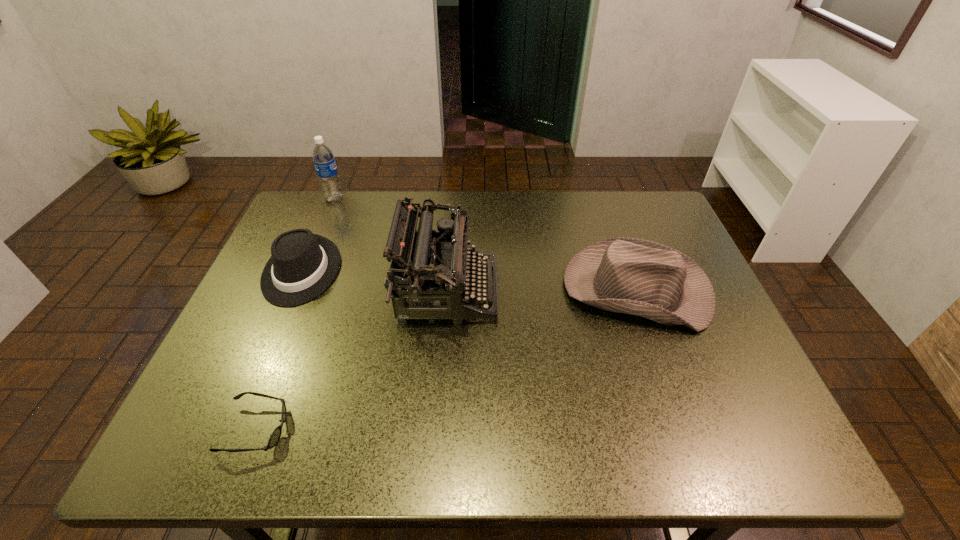
You are a GUI agent. You are given a task and a screenshot of the screen. Output one action in this format:
    pyautogui.click(x=<x>, y=<y>)
    Task: Click on the blank space located on the front of the taller fedora
    
    Given the screenshot: What is the action you would take?
    pyautogui.click(x=672, y=390)

You are a GUI agent. You are given a task and a screenshot of the screen. Output one action in this format:
    pyautogui.click(x=<x>, y=<y>)
    Task: Click on the vacant region located on the front-facing side of the shorter fedora
    Image resolution: width=960 pixels, height=540 pixels.
    Given the screenshot: What is the action you would take?
    pyautogui.click(x=254, y=384)

I want to click on free space located 0.100m on the lenses of the shortest object, so click(337, 429).

This screenshot has height=540, width=960. Find the location of `object that is at the far edge`. object that is at the far edge is located at coordinates (323, 158).

You are a GUI agent. You are given a task and a screenshot of the screen. Output one action in this format:
    pyautogui.click(x=<x>, y=<y>)
    Task: Click on the object that is at the near edge
    
    Given the screenshot: What is the action you would take?
    pos(275,436)

Locate an element on the screen. water bottle situated at the left edge is located at coordinates (323, 158).

The width and height of the screenshot is (960, 540). Identify the location of fedora that is positioned at the left edge. (302, 265).

Locate an element on the screen. The width and height of the screenshot is (960, 540). sunglasses at the left edge is located at coordinates (275, 436).

Image resolution: width=960 pixels, height=540 pixels. I want to click on object present at the right edge, so click(633, 276).

Identify the location of object at the far left corner. The height and width of the screenshot is (540, 960). (323, 158).